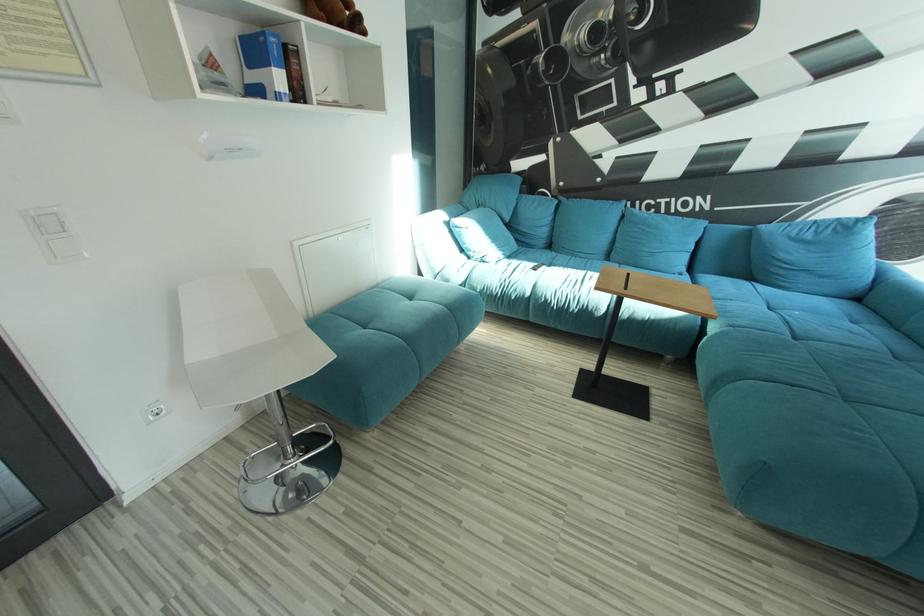
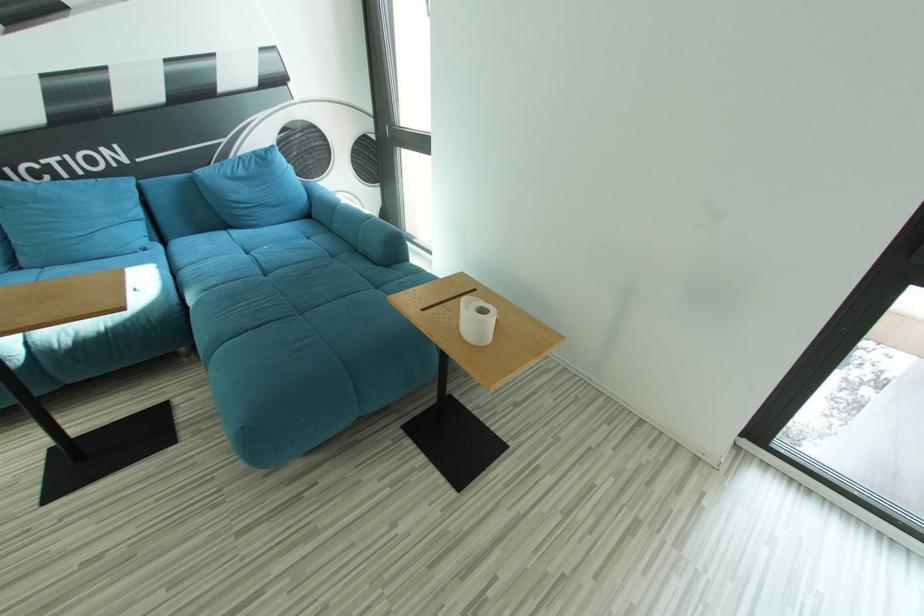
First-person continuous shooting, in which direction is the camera rotating?

The camera's rotation is toward right-down.